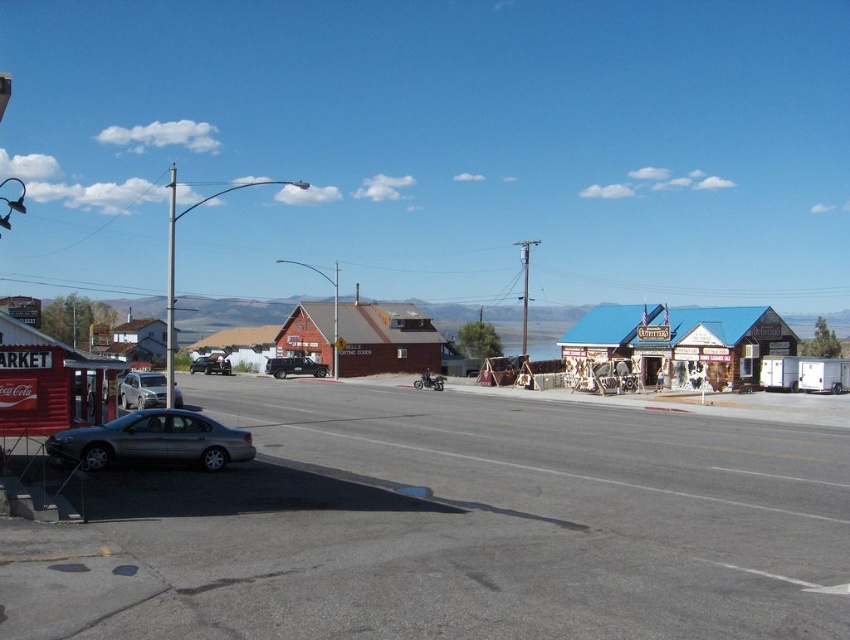
Question: Is wooden signboard at center to the right of red wooden market at lower left from the viewer's perspective?

Choices:
 (A) no
 (B) yes

Answer: (B)

Question: Does silver metallic car at left appear under brushed metal pole at center?

Choices:
 (A) no
 (B) yes

Answer: (B)

Question: Where is wooden signboard at center located in relation to satin silver sedan at lower left in the image?

Choices:
 (A) left
 (B) right

Answer: (B)

Question: Considering the real-world distances, which object is closest to the brushed metal pole at center?

Choices:
 (A) wooden signboard at center
 (B) satin silver sedan at lower left
 (C) matte black truck at center

Answer: (C)

Question: Which of the following is the closest to the observer?

Choices:
 (A) satin silver sedan at lower left
 (B) red wooden market at lower left

Answer: (B)

Question: Among these points, which one is farthest from the camera?

Choices:
 (A) (77, 380)
 (B) (440, 339)
 (C) (95, 435)

Answer: (B)